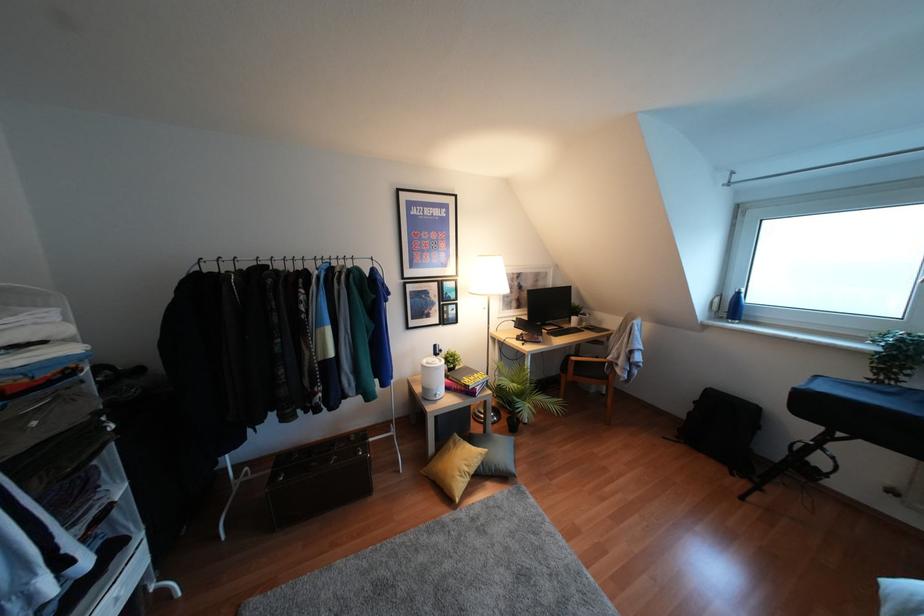
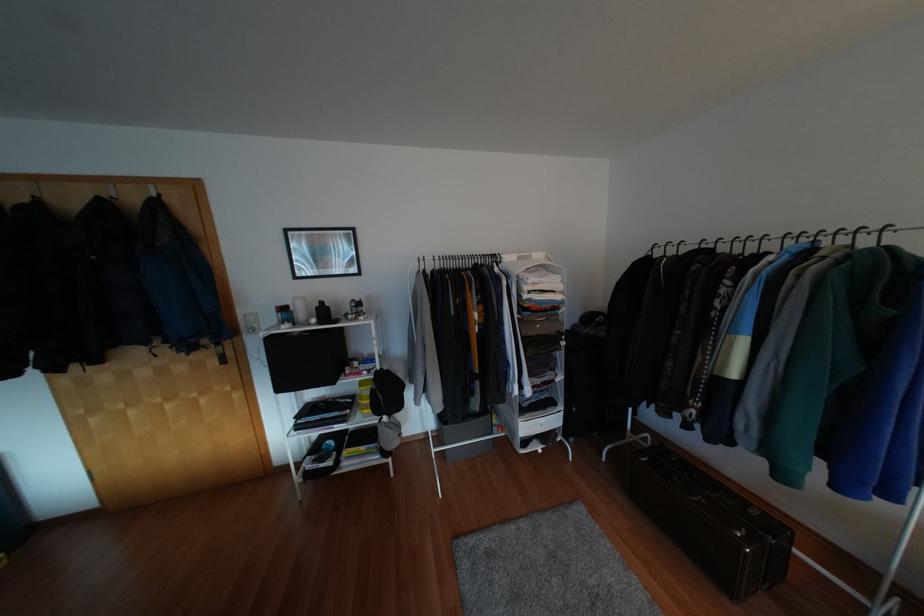
Question: Based on the continuous images, in which direction is the camera rotating? Reply with the corresponding letter.

Choices:
 (A) Left
 (B) Right
 (C) Up
 (D) Down

Answer: (A)